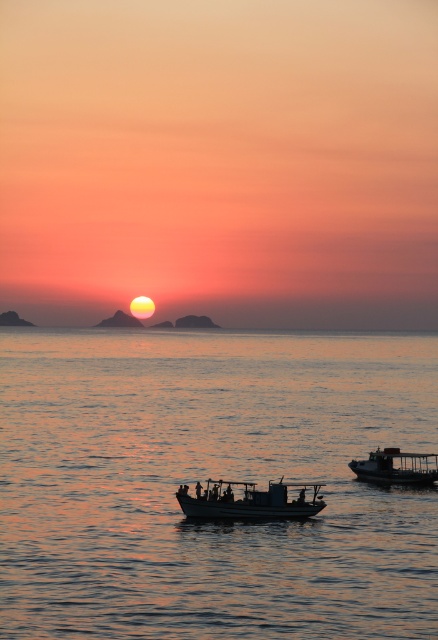
Is point (409, 368) farther from camera compared to point (276, 499)?

Yes, it is behind point (276, 499).

Find the location of a particular element. smooth water at center is located at coordinates (215, 477).

Does smooth water at center have a greater width compared to metallic gray boat at lower right?

Yes.

Is point (168, 541) closer to viewer compared to point (392, 483)?

Yes, point (168, 541) is in front of point (392, 483).

Is point (21, 621) positioned in front of point (353, 468)?

Yes, point (21, 621) is in front of point (353, 468).

Where is `smooth water at center`? smooth water at center is located at coordinates (215, 477).

Is white matte boat at center to the right of metallic gray boat at lower right from the viewer's perspective?

In fact, white matte boat at center is to the left of metallic gray boat at lower right.

Which is in front, point (286, 486) or point (378, 451)?

Positioned in front is point (286, 486).

Locate an element on the screen. The height and width of the screenshot is (640, 438). white matte boat at center is located at coordinates (248, 500).